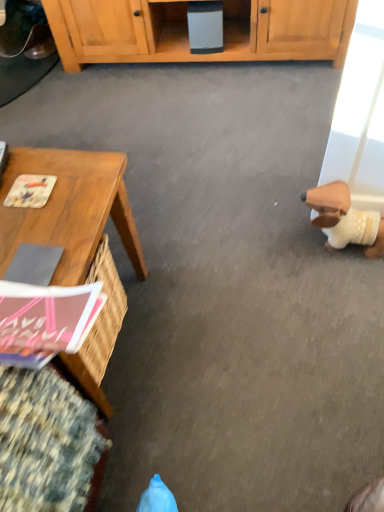
Where is `vacant area in front of printed paper magazine at left, the 2th magazine viewed from the front`? The image size is (384, 512). vacant area in front of printed paper magazine at left, the 2th magazine viewed from the front is located at coordinates (38, 237).